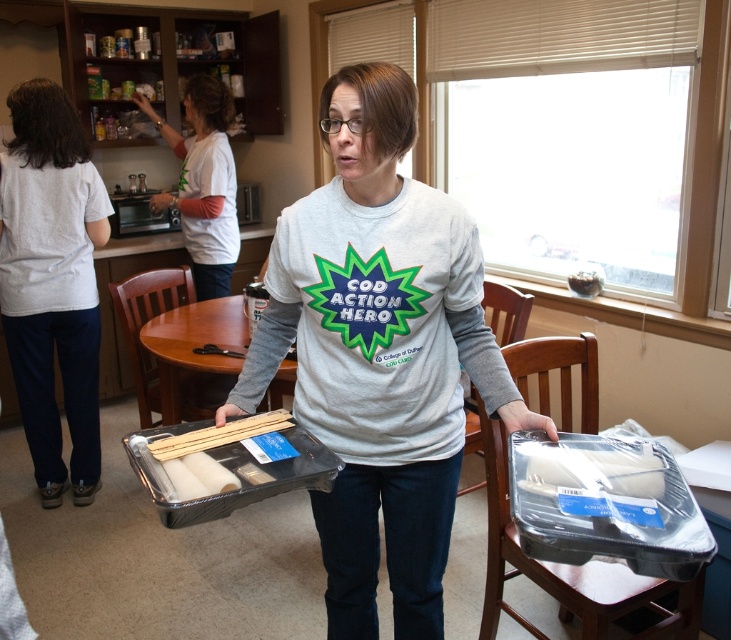
Who is lower down, white t-shirt at center or brown wooden table at center?

brown wooden table at center

Is white t-shirt at center positioned in front of brown wooden table at center?

No.

Who is more forward, (x=212, y=237) or (x=227, y=330)?

Positioned in front is point (x=227, y=330).

At what (x,y) coordinates should I click in order to perform the action: click on white t-shirt at center. Please return your answer as a coordinate pair (x, y). Looking at the image, I should click on (202, 182).

Is white cotton shirt at left to the left of brown wooden table at center from the viewer's perspective?

Indeed, white cotton shirt at left is positioned on the left side of brown wooden table at center.

Does white cotton shirt at left have a larger size compared to brown wooden table at center?

No.

Identify the location of white cotton shirt at left. (53, 282).

Does white cotton shirt at left appear over white t-shirt at center?

Actually, white cotton shirt at left is below white t-shirt at center.

Between white cotton shirt at left and white t-shirt at center, which one has less height?

white t-shirt at center is shorter.

Locate an element on the screen. white cotton shirt at left is located at coordinates (53, 282).

Find the location of a particular element. The height and width of the screenshot is (640, 731). white cotton shirt at left is located at coordinates (53, 282).